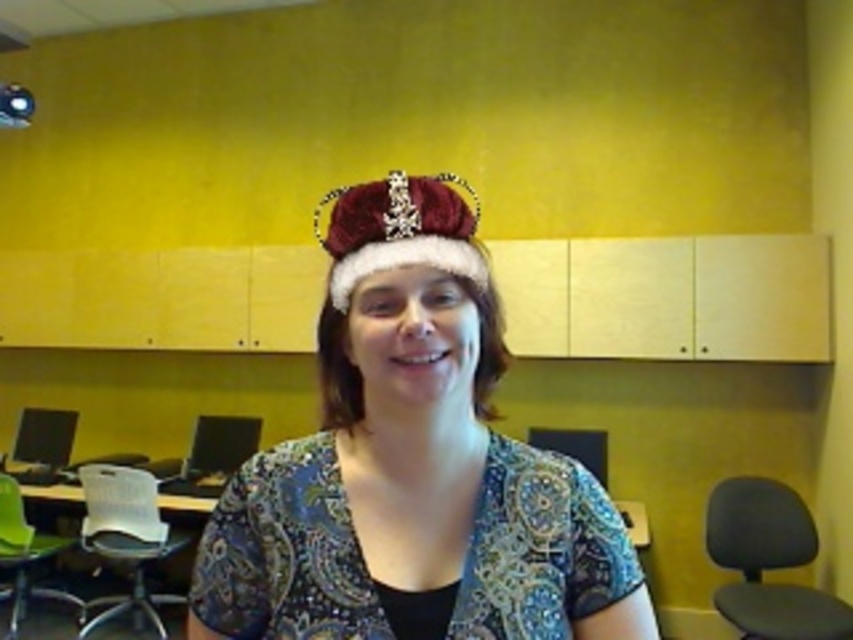
Between velvet crown at center and velvet red tiara at center, which one appears on the left side from the viewer's perspective?

velvet crown at center

Is point (614, 612) more distant than point (368, 195)?

Yes, point (614, 612) is behind point (368, 195).

Does point (347, 442) lie in front of point (457, 221)?

That is False.

You are a GUI agent. You are given a task and a screenshot of the screen. Output one action in this format:
    pyautogui.click(x=<x>, y=<y>)
    Task: Click on the velvet crown at center
    This screenshot has width=853, height=640.
    Given the screenshot: What is the action you would take?
    pyautogui.click(x=412, y=465)